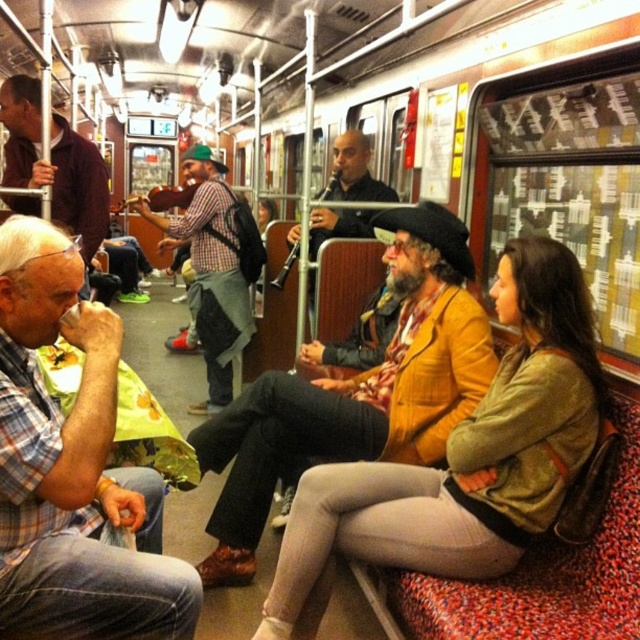
Question: Which object is farther from the camera taking this photo?

Choices:
 (A) plaid fabric coach at left
 (B) checkered fabric shirt at center
 (C) matte green jacket at center

Answer: (B)

Question: Which point appears farthest from the camera in this image?

Choices:
 (A) click(340, 209)
 (B) click(356, 490)
 (C) click(20, 102)
 (D) click(396, 374)

Answer: (A)

Question: Is matte green jacket at center to the left of checkered fabric shirt at center from the viewer's perspective?

Choices:
 (A) no
 (B) yes

Answer: (A)

Question: Among these points, which one is nearest to the camera?

Choices:
 (A) (470, 269)
 (B) (348, 170)

Answer: (A)

Question: Is plaid shirt at left bigger than matte black jacket at center?

Choices:
 (A) no
 (B) yes

Answer: (A)

Question: Is checkered fabric shirt at center wider than plaid shirt at left?

Choices:
 (A) no
 (B) yes

Answer: (B)